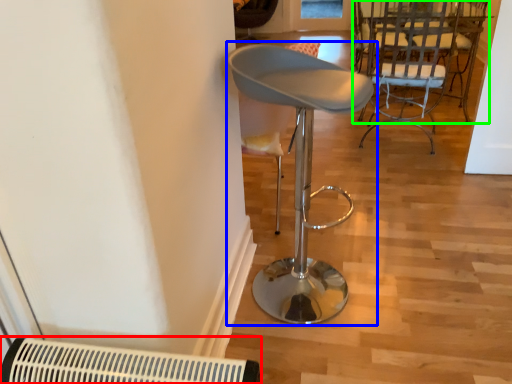
Question: Which object is positioned closest to air conditioning (highlighted by a red box)? Select from chair (highlighted by a blue box) and chair (highlighted by a green box).

Choices:
 (A) chair
 (B) chair

Answer: (A)